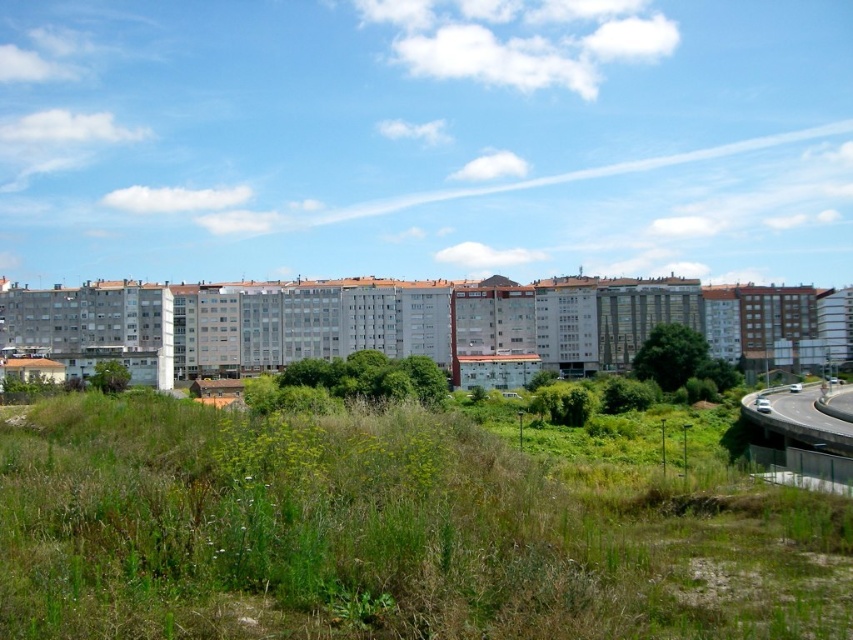
Is green grassy at lower center thinner than gray concrete highway at lower right?

In fact, green grassy at lower center might be wider than gray concrete highway at lower right.

Is green grassy at lower center to the right of gray concrete highway at lower right from the viewer's perspective?

No, green grassy at lower center is not to the right of gray concrete highway at lower right.

From the picture: Who is more forward, (547,502) or (791,408)?

Point (547,502) is more forward.

Find the location of a particular element. The width and height of the screenshot is (853, 640). green grassy at lower center is located at coordinates (370, 536).